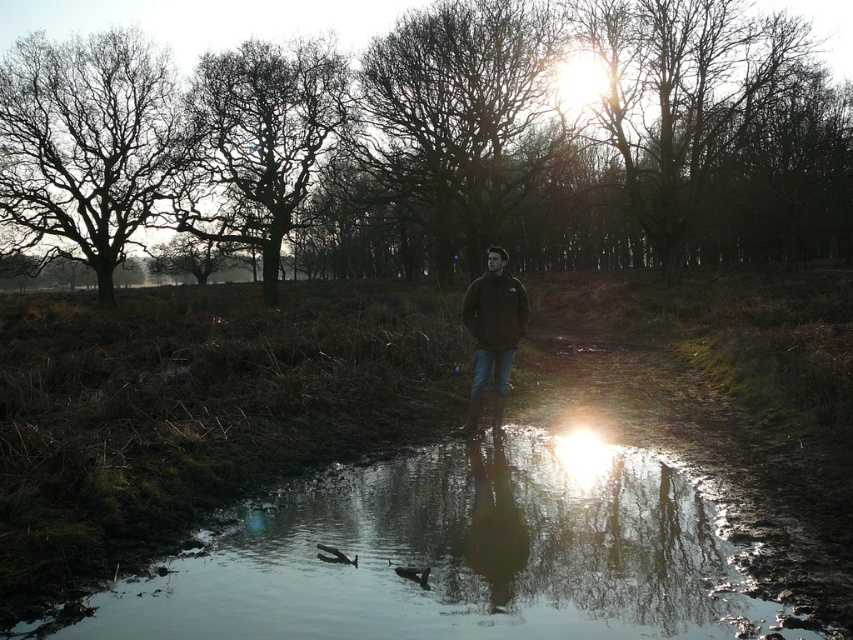
Question: Based on their relative distances, which object is nearer to the bare branches at left?

Choices:
 (A) dark brown feathers at lower center
 (B) bare branches at center

Answer: (B)

Question: Does bare branches at left have a larger size compared to dark green fleece jacket at center?

Choices:
 (A) no
 (B) yes

Answer: (B)

Question: Among these objects, which one is farthest from the camera?

Choices:
 (A) brown leafless tree at upper center
 (B) shiny reflective water at center
 (C) bare branches at left

Answer: (A)

Question: Which of the following is the closest to the observer?

Choices:
 (A) dark brown bark tree at upper left
 (B) bare branches at left
 (C) dark green fleece jacket at center
 (D) brown leafless tree at upper center

Answer: (C)

Question: Can you confirm if brown leafless tree at upper center is positioned above bare branches at left?

Choices:
 (A) yes
 (B) no

Answer: (B)

Question: Can you confirm if shiny reflective water at center is bigger than dark green fleece jacket at center?

Choices:
 (A) yes
 (B) no

Answer: (A)